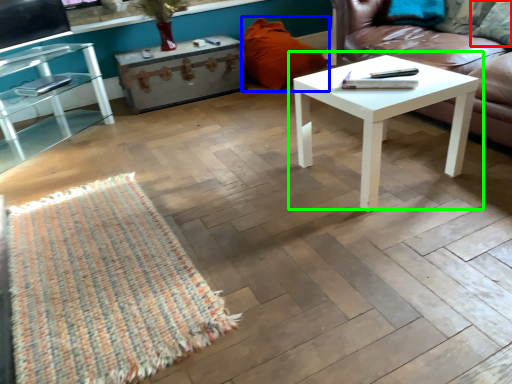
Question: Which object is the closest to the pillow (highlighted by a red box)? Choose among these: pillow (highlighted by a blue box) or coffee table (highlighted by a green box).

Choices:
 (A) pillow
 (B) coffee table

Answer: (B)